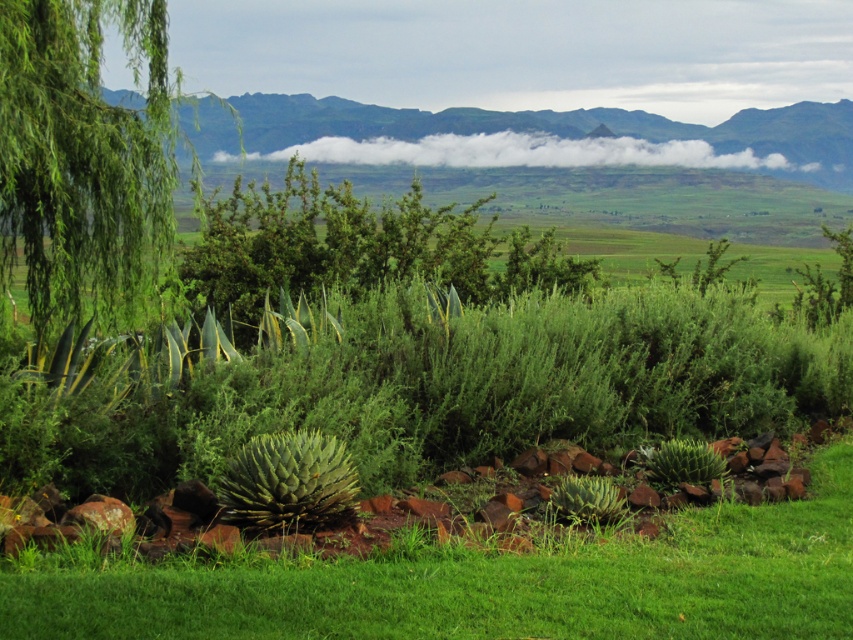
You are standing in the middle of the grassy area and want to walk towards the distant mountain range. Which point, point (660, 593) or point (321, 504), is closer to your current position?

Point (660, 593) is closer to the viewer than point (321, 504), so it is closer to your current position in the middle of the grassy area.

You are standing at the viewpoint in the image and notice two points marked in the scene. Which point, point (x=13, y=241) or point (x=291, y=435), is closer to you?

Point (x=291, y=435) is closer to you because it is in front of point (x=13, y=241).

You are a gardener planning to plant a new flower bed. You observe the green grassy at center and the green spiky plant at center. Which of these two has a shorter height?

The green grassy at center has a lesser height compared to the green spiky plant at center, so the green grassy at center is shorter.